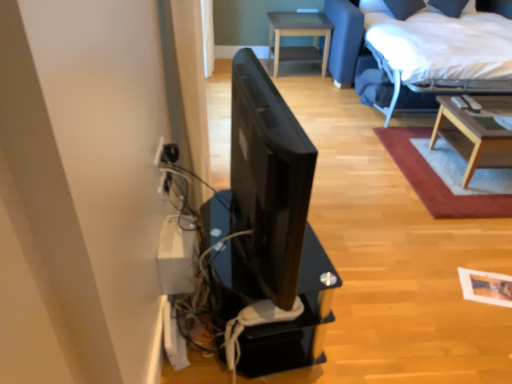
Question: Would you say white fabric bed at upper right is inside or outside black glossy monitor at center?

Choices:
 (A) inside
 (B) outside

Answer: (B)

Question: Looking at the image, does white fabric bed at upper right seem bigger or smaller compared to black glossy monitor at center?

Choices:
 (A) small
 (B) big

Answer: (B)

Question: Estimate the real-world distances between objects in this image. Which object is closer to the white fabric bed at upper right?

Choices:
 (A) light wood/texture coffee table at upper right, positioned as the 2th table in left-to-right order
 (B) light brown wooden table at upper center, the 1th table from the back
 (C) black glossy monitor at center
 (D) wooden coffee table at upper right

Answer: (A)

Question: Which object is the farthest from the wooden coffee table at upper right?

Choices:
 (A) light brown wooden table at upper center, the 1th table from the back
 (B) white fabric bed at upper right
 (C) black glossy monitor at center
 (D) light wood/texture coffee table at upper right, which is counted as the 2th table, starting from the top

Answer: (A)